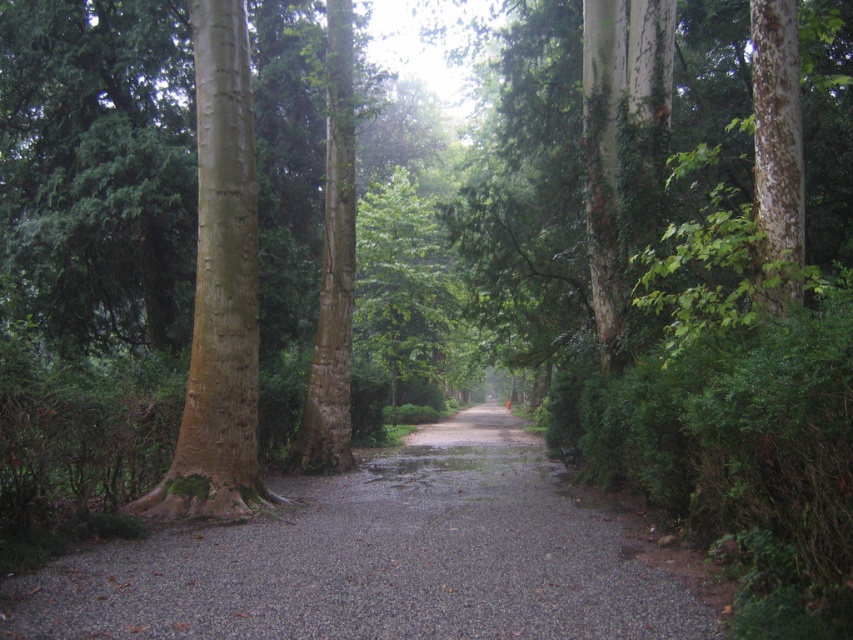
You are a gardener planning to place a large decorative stone sculpture that is 2 meters wide in the middle of the gray gravel alley at center. Considering the size of the brown rough bark tree at left, will the sculpture fit without blocking the tree?

The gray gravel alley at center is bigger than the brown rough bark tree at left. Since the alley is larger, the 2m wide sculpture can be placed in the center without blocking the tree.